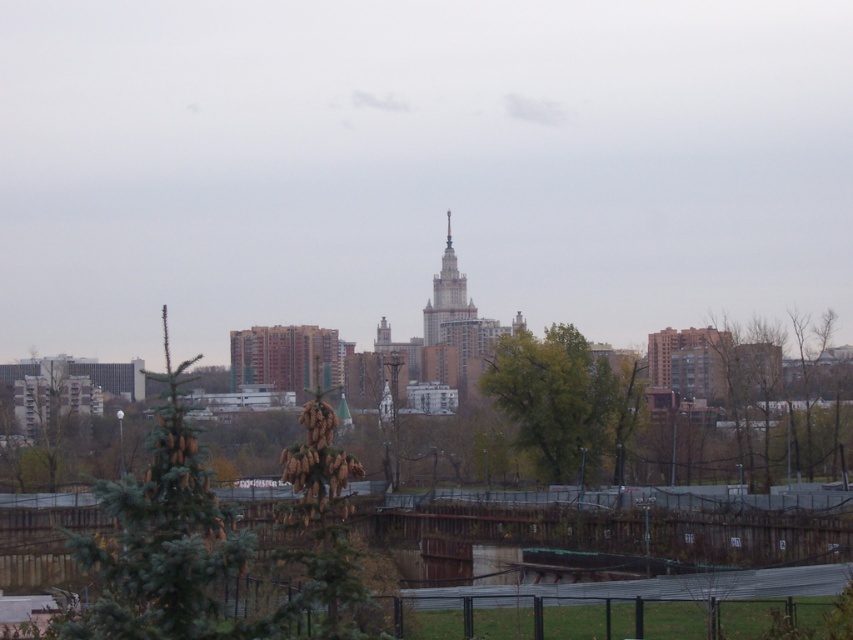
Question: Which object is closer to the camera taking this photo?

Choices:
 (A) green leafy tree at center
 (B) polished silver spire at center
 (C) green matte tree at left

Answer: (C)

Question: Is brown textured pine cone at center thinner than polished silver spire at center?

Choices:
 (A) no
 (B) yes

Answer: (B)

Question: Which object is farther from the camera taking this photo?

Choices:
 (A) green leafy tree at center
 (B) polished silver spire at center
 (C) brown textured pine cone at center
 (D) green matte tree at left

Answer: (B)

Question: Is green matte tree at left below polished silver spire at center?

Choices:
 (A) yes
 (B) no

Answer: (A)

Question: Which object is the farthest from the green matte tree at left?

Choices:
 (A) polished silver spire at center
 (B) green leafy tree at center
 (C) brown textured pine cone at center

Answer: (A)

Question: Is brown textured pine cone at center wider than polished silver spire at center?

Choices:
 (A) no
 (B) yes

Answer: (A)